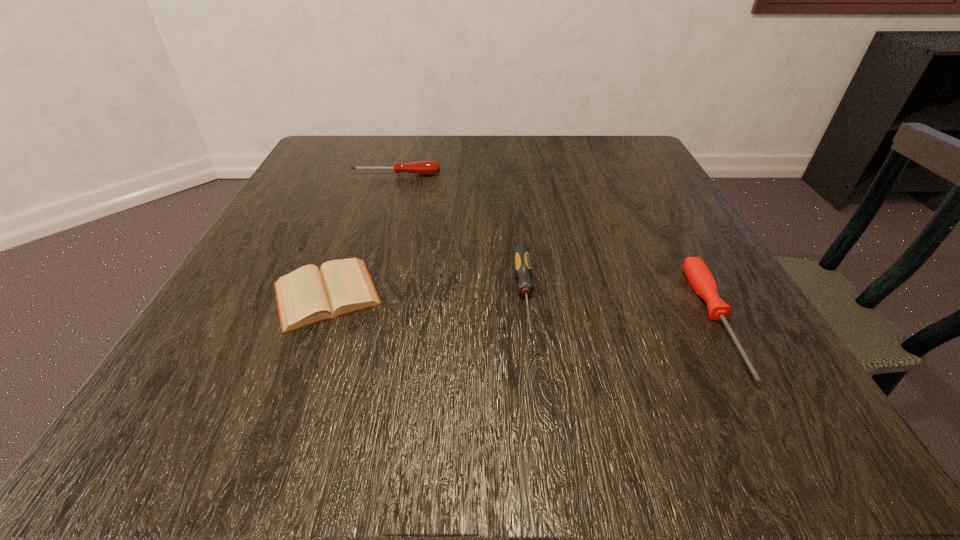
This screenshot has width=960, height=540. In order to click on free space at the near right corner of the desktop in this screenshot , I will do `click(791, 396)`.

The image size is (960, 540). Find the location of `free area in between the rightmost screwdriver and the diary`. free area in between the rightmost screwdriver and the diary is located at coordinates click(521, 307).

At what (x,y) coordinates should I click in order to perform the action: click on free area in between the rightmost object and the farthest screwdriver. Please return your answer as a coordinate pair (x, y). Looking at the image, I should click on [557, 247].

The width and height of the screenshot is (960, 540). Identify the location of free space between the shortest object and the rightmost screwdriver. (521, 307).

Find the location of a particular element. The width and height of the screenshot is (960, 540). free space between the rightmost object and the diary is located at coordinates (521, 307).

Where is `free space that is in between the leftmost screwdriver and the rightmost object`? The width and height of the screenshot is (960, 540). free space that is in between the leftmost screwdriver and the rightmost object is located at coordinates (557, 247).

Where is `empty space that is in between the farthest screwdriver and the rightmost screwdriver`? The image size is (960, 540). empty space that is in between the farthest screwdriver and the rightmost screwdriver is located at coordinates (557, 247).

Where is `vacant area between the second object from right to left and the rightmost screwdriver`? The image size is (960, 540). vacant area between the second object from right to left and the rightmost screwdriver is located at coordinates (621, 307).

Where is `vacant space that is in between the shortest object and the second screwdriver from left to right`? The image size is (960, 540). vacant space that is in between the shortest object and the second screwdriver from left to right is located at coordinates (425, 294).

Find the location of `vacant space that is in between the rightmost screwdriver and the shortest object`. vacant space that is in between the rightmost screwdriver and the shortest object is located at coordinates (521, 307).